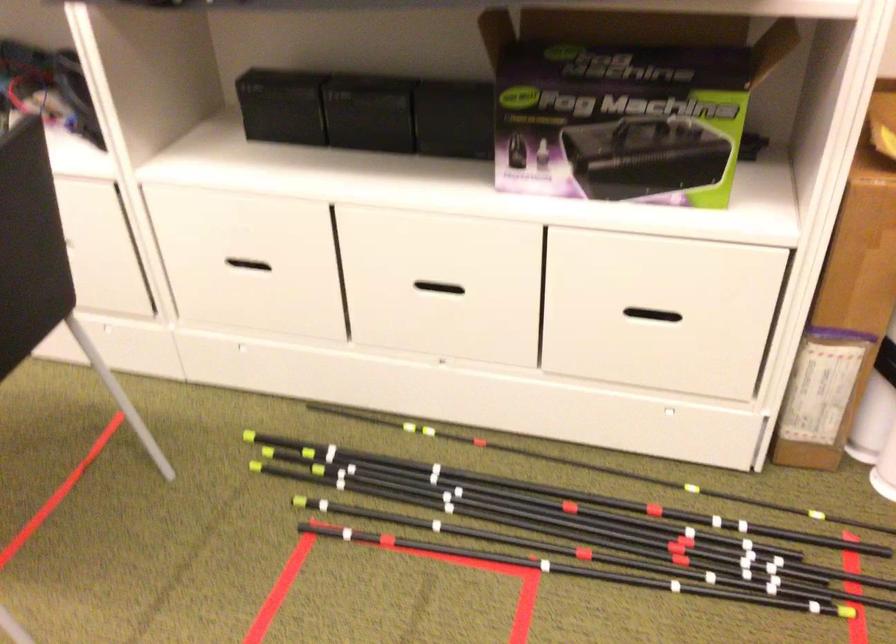
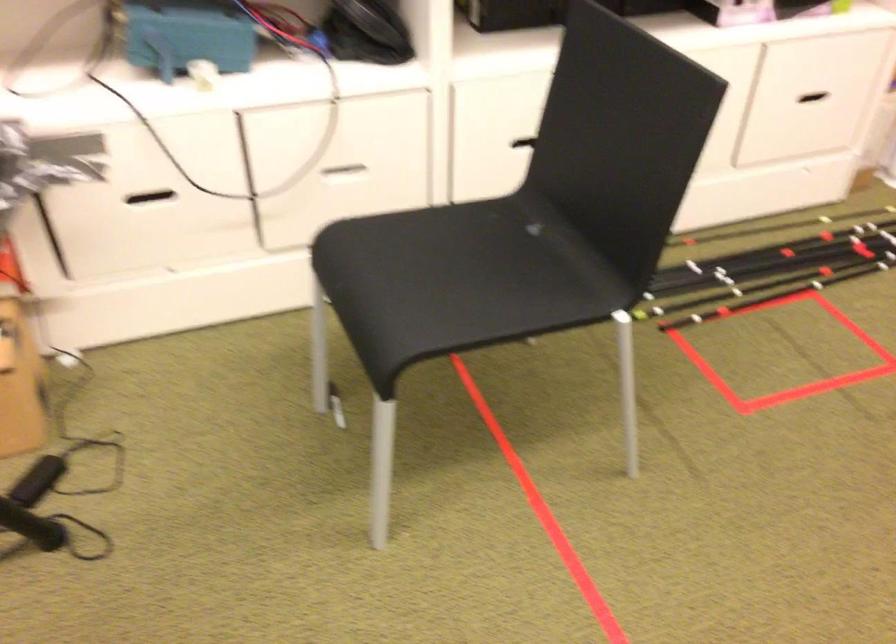
Question: I am providing you with two images of the same scene from different viewpoints. Please identify which objects are invisible in image2.

Choices:
 (A) chair sitting surface
 (B) white drawer handle
 (C) white owl figure
 (D) drawer handle

Answer: (B)